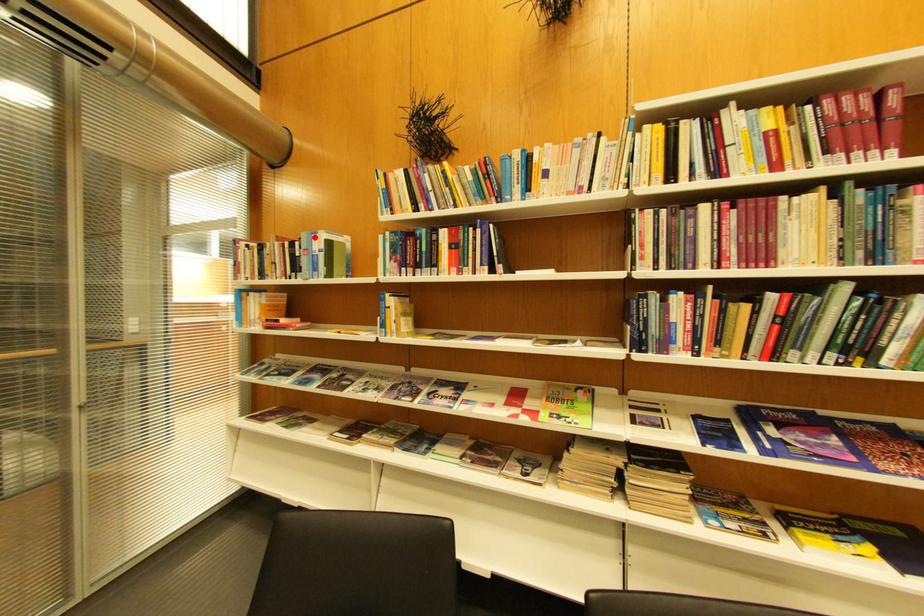
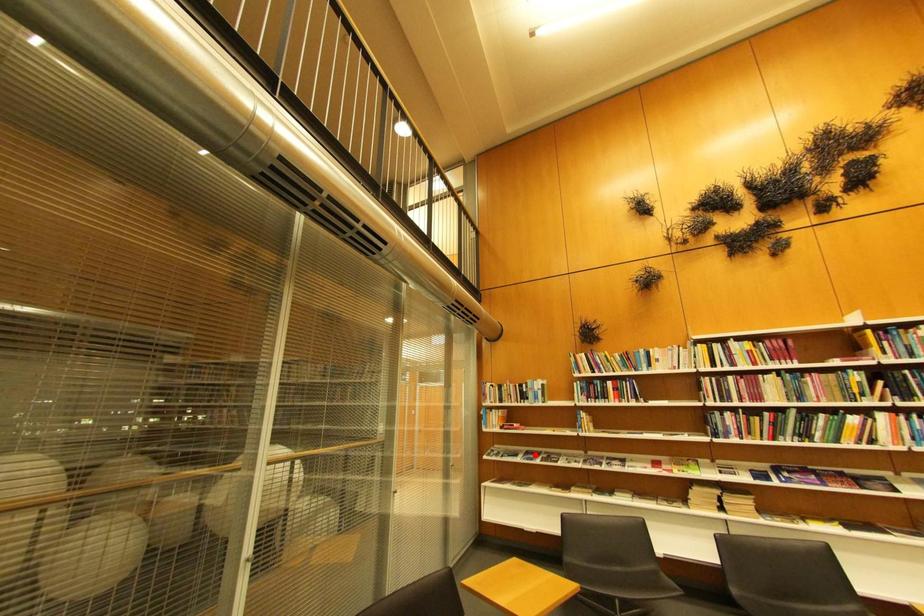
I am providing you with two images of the same scene from different viewpoints. A red point is marked on the first image and another point is marked on the second image. Does the point marked in image1 correspond to the same location as the one in image2?

No